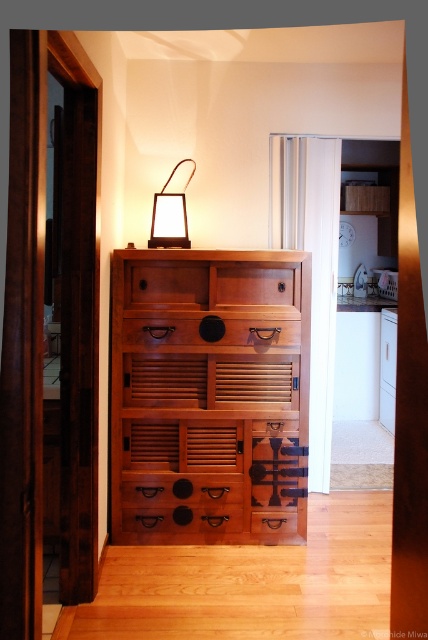
You are organizing items on a wooden cabinet in a hallway. You have two drawers labeled as brown matte drawer at center and matte brown drawer at center. According to their positions, which drawer should you place an item on if you want it to be closer to the left side of the cabinet?

The brown matte drawer at center is to the left of the matte brown drawer at center, so placing the item on the brown matte drawer at center will make it closer to the left side of the cabinet.

You are standing in the hallway and need to place a tall plant that requires 1.5 meters of vertical space. Can the wooden dresser at center and the matte brown drawer at center accommodate it based on their heights?

The wooden dresser at center is taller than the matte brown drawer at center. Since the plant requires 1.5 meters of vertical space, you should check the height of the wooden dresser at center to see if it meets or exceeds 1.5 meters. The matte brown drawer at center is shorter and likely insufficient.